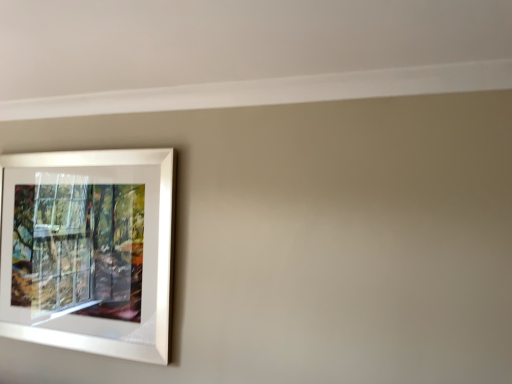
This screenshot has height=384, width=512. Describe the element at coordinates (88, 249) in the screenshot. I see `white glossy picture frame at left` at that location.

Find the location of a particular element. white glossy picture frame at left is located at coordinates (88, 249).

You are a GUI agent. You are given a task and a screenshot of the screen. Output one action in this format:
    pyautogui.click(x=<x>, y=<y>)
    Task: Click on the white glossy picture frame at left
    This screenshot has width=512, height=384.
    Given the screenshot: What is the action you would take?
    pyautogui.click(x=88, y=249)